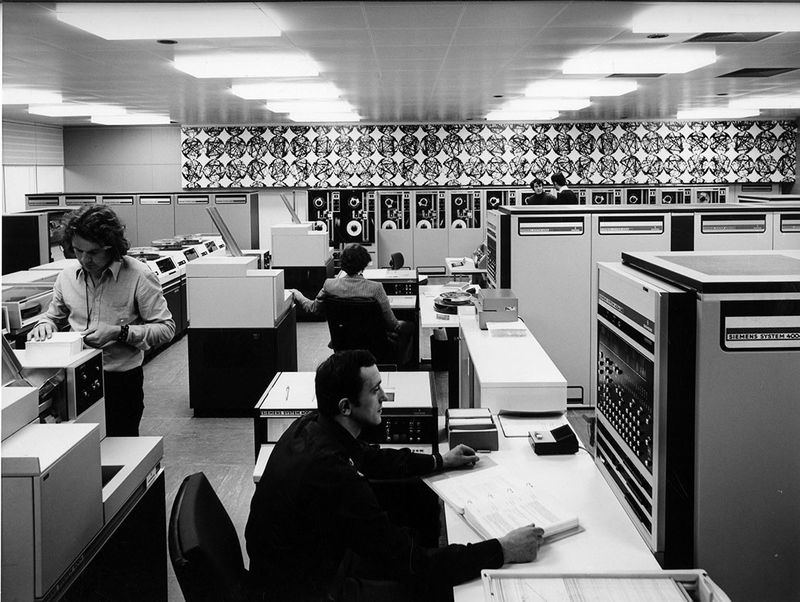
Locate an element on the screen. This screenshot has width=800, height=602. patterned wall is located at coordinates (398, 155).